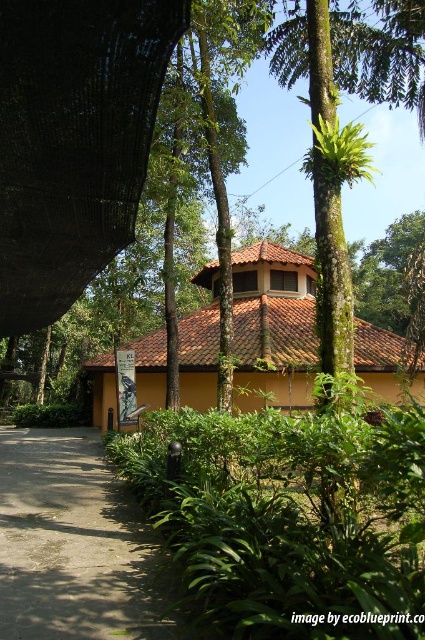
You are standing in front of the traditional building and want to walk from the gray concrete driveway at lower left to the green leafy shrubs at center. Which direction should you move to reach the shrubs?

The green leafy shrubs at center are closer to you than the gray concrete driveway at lower left, so you should move forward towards the shrubs to reach them.